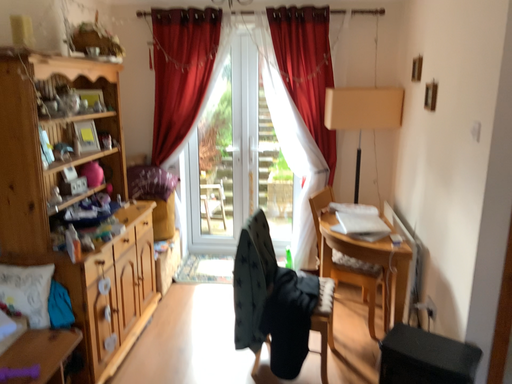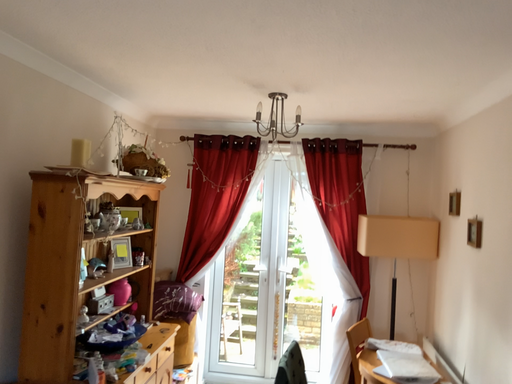
Question: Which way did the camera rotate in the video?

Choices:
 (A) rotated upward
 (B) rotated downward

Answer: (A)